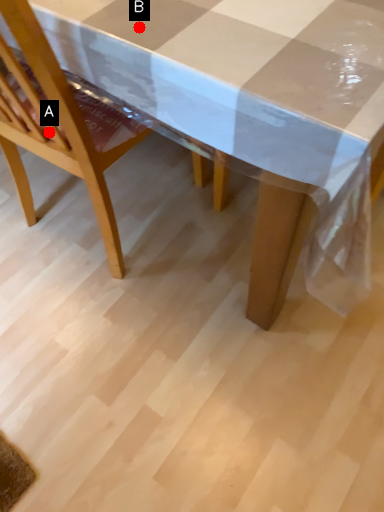
Question: Two points are circled on the image, labeled by A and B beside each circle. Among these points, which one is nearest to the camera?

Choices:
 (A) A is closer
 (B) B is closer

Answer: (B)